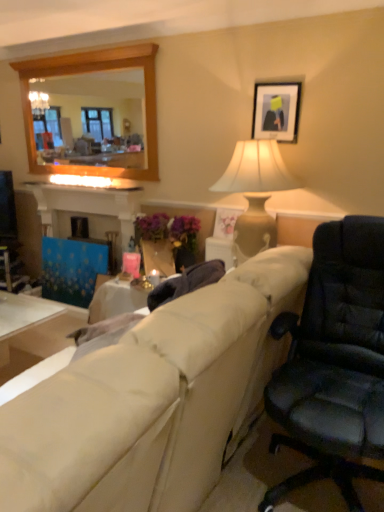
Question: Does matte beige vase at center have a lesser width compared to wooden frame mirror at upper left?

Choices:
 (A) no
 (B) yes

Answer: (A)

Question: Is matte beige vase at center behind wooden frame mirror at upper left?

Choices:
 (A) no
 (B) yes

Answer: (A)

Question: Can you confirm if matte beige vase at center is positioned to the right of wooden frame mirror at upper left?

Choices:
 (A) no
 (B) yes

Answer: (B)

Question: Is matte beige vase at center in contact with wooden frame mirror at upper left?

Choices:
 (A) no
 (B) yes

Answer: (A)

Question: From a real-world perspective, is matte beige vase at center physically below wooden frame mirror at upper left?

Choices:
 (A) yes
 (B) no

Answer: (A)

Question: From a real-world perspective, is wooden frame mirror at upper left physically located above or below matte black picture frame at upper center?

Choices:
 (A) above
 (B) below

Answer: (A)

Question: Considering the positions of wooden frame mirror at upper left and matte black picture frame at upper center in the image, is wooden frame mirror at upper left taller or shorter than matte black picture frame at upper center?

Choices:
 (A) short
 (B) tall

Answer: (B)

Question: Is point pos(77,76) closer or farther from the camera than point pos(253,106)?

Choices:
 (A) farther
 (B) closer

Answer: (A)

Question: Would you say wooden frame mirror at upper left is to the left or to the right of matte black picture frame at upper center in the picture?

Choices:
 (A) right
 (B) left

Answer: (B)

Question: From the image's perspective, is matte beige vase at center positioned above or below beige fabric couch at center?

Choices:
 (A) below
 (B) above

Answer: (B)

Question: Is matte beige vase at center in front of or behind beige fabric couch at center in the image?

Choices:
 (A) behind
 (B) front

Answer: (A)

Question: From a real-world perspective, relative to beige fabric couch at center, is matte beige vase at center vertically above or below?

Choices:
 (A) below
 (B) above

Answer: (B)

Question: Considering the positions of matte beige vase at center and beige fabric couch at center in the image, is matte beige vase at center bigger or smaller than beige fabric couch at center?

Choices:
 (A) small
 (B) big

Answer: (A)

Question: Do you think matte black picture frame at upper center is within wooden frame mirror at upper left, or outside of it?

Choices:
 (A) outside
 (B) inside

Answer: (A)

Question: From a real-world perspective, is matte black picture frame at upper center above or below wooden frame mirror at upper left?

Choices:
 (A) above
 (B) below

Answer: (B)